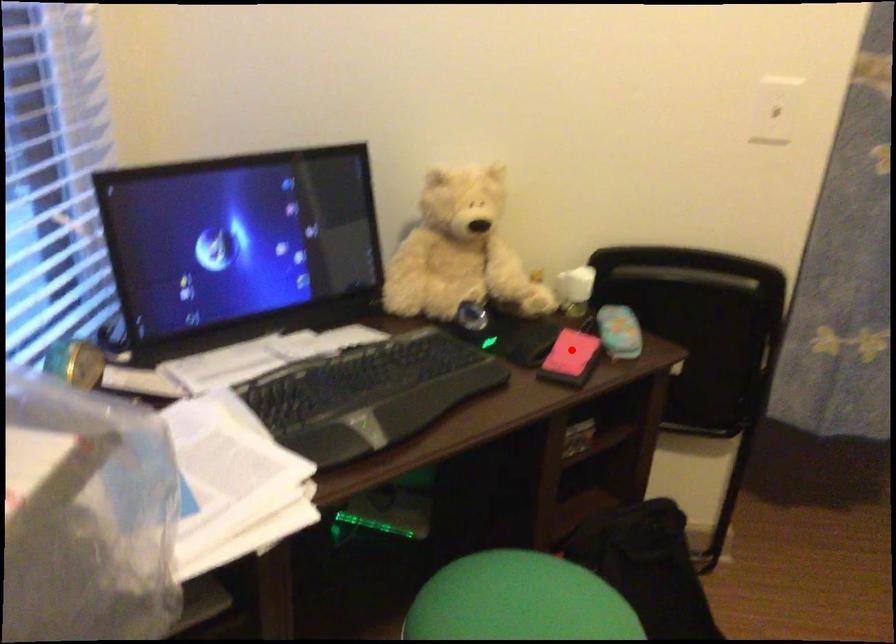
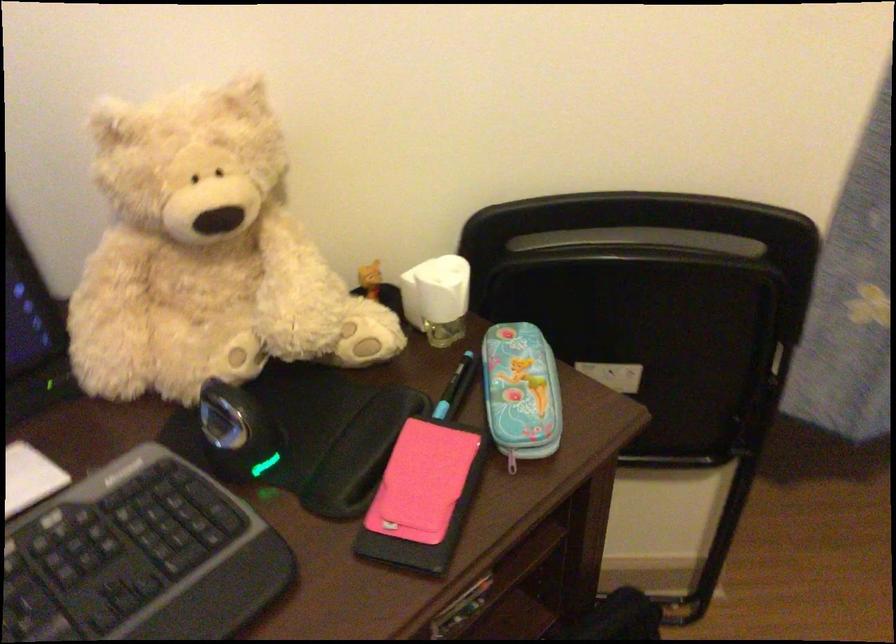
Question: I am providing you with two images of the same scene from different viewpoints. A red point is shown in image1. For the corresponding object point in image2, is it positioned nearer or farther from the camera?

Choices:
 (A) Nearer
 (B) Farther

Answer: (A)